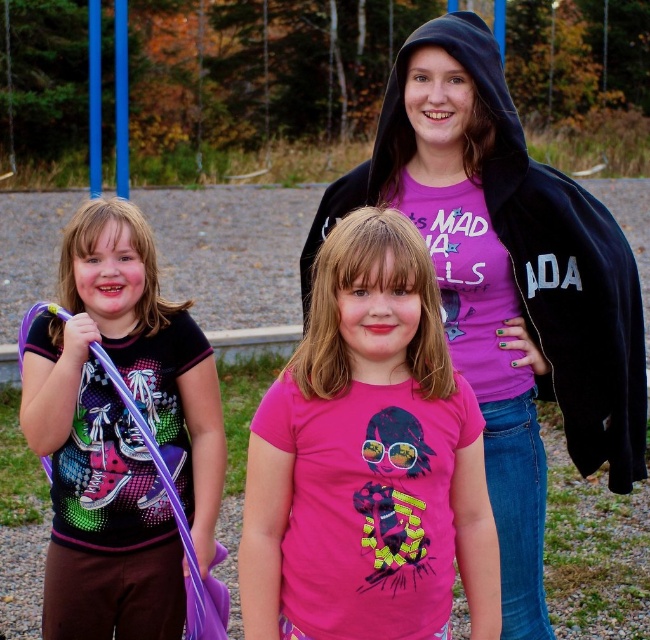
In the scene described, where is the matte black hoodie at upper center located relative to the matte purple wand at left?

The matte black hoodie at upper center is to the right of the matte purple wand at left.